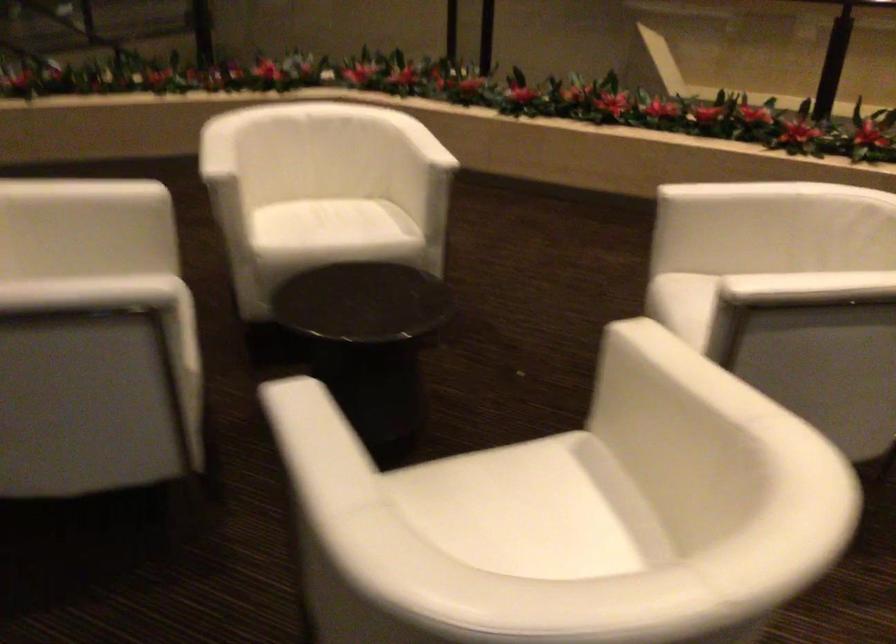
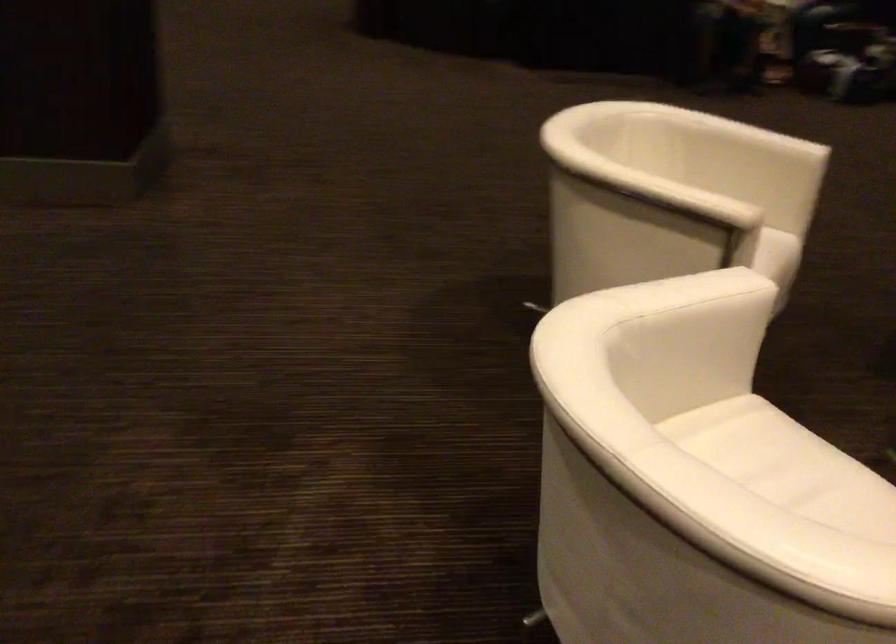
In the second image, find the point that corresponds to point 701,365 in the first image.

(675, 194)